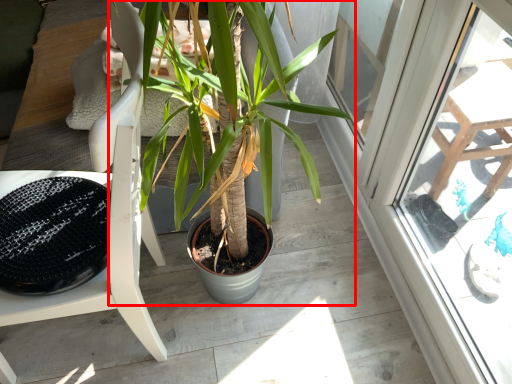
Question: From the image's perspective, considering the relative positions of houseplant (annotated by the red box) and chair in the image provided, where is houseplant (annotated by the red box) located with respect to the staircase?

Choices:
 (A) below
 (B) above

Answer: (B)